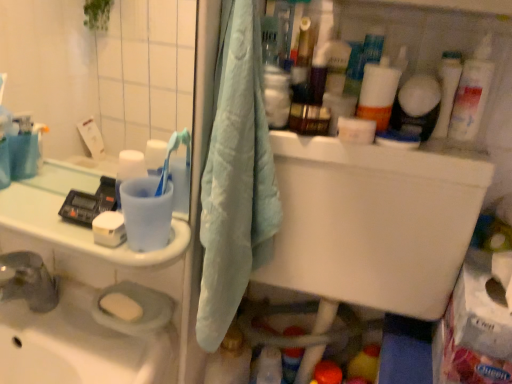
Question: From a real-world perspective, is yellow matte soap at lower left, which appears as the 1th soap when ordered from the bottom, positioned over white glossy cup at left based on gravity?

Choices:
 (A) no
 (B) yes

Answer: (A)

Question: Is yellow matte soap at lower left, which appears as the 1th soap when ordered from the bottom, at the left side of white glossy cup at left?

Choices:
 (A) no
 (B) yes

Answer: (A)

Question: Considering the relative sizes of yellow matte soap at lower left, which is the second soap from top to bottom, and white glossy cup at left in the image provided, is yellow matte soap at lower left, which is the second soap from top to bottom, bigger than white glossy cup at left?

Choices:
 (A) no
 (B) yes

Answer: (A)

Question: Is yellow matte soap at lower left, the first soap positioned from the back, positioned beyond the bounds of white glossy cup at left?

Choices:
 (A) no
 (B) yes

Answer: (B)

Question: From a real-world perspective, is yellow matte soap at lower left, the first soap positioned from the back, positioned under white glossy cup at left based on gravity?

Choices:
 (A) no
 (B) yes

Answer: (B)

Question: Is yellow matte soap at lower left, the 2th soap from the front, shorter than white glossy cup at left?

Choices:
 (A) no
 (B) yes

Answer: (B)

Question: Would you consider white plastic tube at upper right to be distant from yellow matte soap at lower left, the 2th soap from the front?

Choices:
 (A) yes
 (B) no

Answer: (B)

Question: Considering the relative sizes of white plastic tube at upper right and yellow matte soap at lower left, which appears as the 1th soap when ordered from the bottom, in the image provided, is white plastic tube at upper right wider than yellow matte soap at lower left, which appears as the 1th soap when ordered from the bottom,?

Choices:
 (A) yes
 (B) no

Answer: (B)

Question: Is yellow matte soap at lower left, which is the second soap from top to bottom, at the back of white plastic tube at upper right?

Choices:
 (A) no
 (B) yes

Answer: (A)

Question: Is white plastic tube at upper right surrounding yellow matte soap at lower left, the first soap positioned from the back?

Choices:
 (A) yes
 (B) no

Answer: (B)

Question: Does white plastic tube at upper right have a lesser height compared to yellow matte soap at lower left, which appears as the 1th soap when ordered from the bottom?

Choices:
 (A) yes
 (B) no

Answer: (B)

Question: Considering the relative positions of white plastic tube at upper right and yellow matte soap at lower left, the 2th soap from the front, in the image provided, is white plastic tube at upper right to the right of yellow matte soap at lower left, the 2th soap from the front, from the viewer's perspective?

Choices:
 (A) no
 (B) yes

Answer: (B)

Question: Is light blue fabric towel at center touching white glossy cup at left?

Choices:
 (A) no
 (B) yes

Answer: (A)